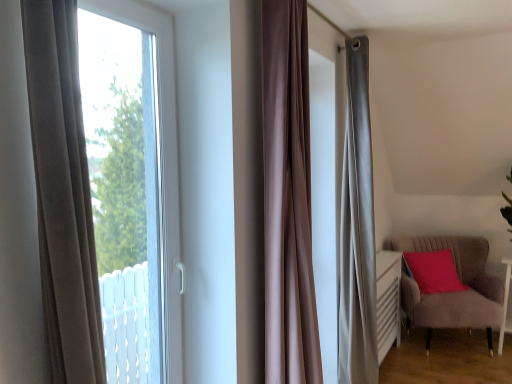
In order to click on velvet grey armchair at lower right in this screenshot , I will do `click(453, 292)`.

The image size is (512, 384). What do you see at coordinates (505, 304) in the screenshot?
I see `white glossy side table at lower right` at bounding box center [505, 304].

What do you see at coordinates (433, 271) in the screenshot? I see `matte pink cushion at right` at bounding box center [433, 271].

This screenshot has width=512, height=384. What are the coordinates of `satin brown curtain at center` in the screenshot? It's located at (288, 198).

You are a GUI agent. You are given a task and a screenshot of the screen. Output one action in this format:
    pyautogui.click(x=<x>, y=<y>)
    Task: Click on the velvet grey armchair at lower right
    
    Given the screenshot: What is the action you would take?
    pyautogui.click(x=453, y=292)

Is white glossy side table at lower right wider or thinner than satin brown curtain at center?

white glossy side table at lower right is wider than satin brown curtain at center.

From the image's perspective, is white glossy side table at lower right under satin brown curtain at center?

Indeed, from the image's perspective, white glossy side table at lower right is shown beneath satin brown curtain at center.

Between white glossy side table at lower right and satin brown curtain at center, which one is positioned in front?

satin brown curtain at center is in front.

From a real-world perspective, is white glossy side table at lower right under satin brown curtain at center?

Yes, from a real-world perspective, white glossy side table at lower right is under satin brown curtain at center.

Which is behind, point (473, 276) or point (502, 323)?

The point (473, 276) is more distant.

Considering the relative positions of velvet grey armchair at lower right and white glossy side table at lower right in the image provided, is velvet grey armchair at lower right to the right of white glossy side table at lower right from the viewer's perspective?

No.

Are velvet grey armchair at lower right and white glossy side table at lower right located far from each other?

No, velvet grey armchair at lower right is not far away from white glossy side table at lower right.

Between point (508, 290) and point (445, 289), which one is positioned behind?

The point (445, 289) is behind.

How many degrees apart are the facing directions of white glossy side table at lower right and matte pink cushion at right?

The facing directions of white glossy side table at lower right and matte pink cushion at right are 40.4 degrees apart.

Is white glossy side table at lower right further to the viewer compared to matte pink cushion at right?

No, white glossy side table at lower right is closer to the viewer.

Consider the image. From the image's perspective, between white glossy side table at lower right and matte pink cushion at right, which one is located above?

From the image's view, matte pink cushion at right is above.

From the image's perspective, which one is positioned higher, velvet grey armchair at lower right or satin brown curtain at center?

satin brown curtain at center is shown above in the image.

Considering the positions of objects velvet grey armchair at lower right and satin brown curtain at center in the image provided, who is behind, velvet grey armchair at lower right or satin brown curtain at center?

velvet grey armchair at lower right is further away from the camera.

Is point (440, 236) closer to viewer compared to point (272, 35)?

No, (440, 236) is further to viewer.

Is velvet grey armchair at lower right beside satin brown curtain at center?

velvet grey armchair at lower right is not next to satin brown curtain at center, and they're not touching.

How different are the orientations of matte pink cushion at right and white glossy side table at lower right in degrees?

matte pink cushion at right and white glossy side table at lower right are facing 40.4 degrees away from each other.

Could you tell me if matte pink cushion at right is turned towards white glossy side table at lower right?

No, matte pink cushion at right is not oriented towards white glossy side table at lower right.

From a real-world perspective, who is located lower, matte pink cushion at right or white glossy side table at lower right?

white glossy side table at lower right, from a real-world perspective.

Does matte pink cushion at right have a lesser width compared to white glossy side table at lower right?

Yes.

From a real-world perspective, is matte pink cushion at right beneath satin brown curtain at center?

Yes, from a real-world perspective, matte pink cushion at right is beneath satin brown curtain at center.

Is matte pink cushion at right thinner than satin brown curtain at center?

Incorrect, the width of matte pink cushion at right is not less than that of satin brown curtain at center.

Does matte pink cushion at right touch satin brown curtain at center?

No, matte pink cushion at right is not beside satin brown curtain at center.

Consider the image. Is matte pink cushion at right inside or outside of satin brown curtain at center?

matte pink cushion at right is not inside satin brown curtain at center, it's outside.

Is velvet grey armchair at lower right closer to camera compared to transparent glass window at left?

That is False.

Considering the relative sizes of velvet grey armchair at lower right and transparent glass window at left in the image provided, is velvet grey armchair at lower right thinner than transparent glass window at left?

Incorrect, the width of velvet grey armchair at lower right is not less than that of transparent glass window at left.

Measure the distance from velvet grey armchair at lower right to transparent glass window at left.

A distance of 9.20 feet exists between velvet grey armchair at lower right and transparent glass window at left.

Would you say transparent glass window at left is part of velvet grey armchair at lower right's contents?

Actually, transparent glass window at left is outside velvet grey armchair at lower right.

I want to click on side table that appears on the right of satin brown curtain at center, so click(x=505, y=304).

The image size is (512, 384). Identify the location of side table lying below the velvet grey armchair at lower right (from the image's perspective). (505, 304).

Based on their spatial positions, is matte pink cushion at right or satin brown curtain at center closer to transparent glass window at left?

satin brown curtain at center is positioned closer to the anchor transparent glass window at left.

Which object lies nearer to the anchor point transparent glass window at left, satin brown curtain at center or white glossy side table at lower right?

Among the two, satin brown curtain at center is located nearer to transparent glass window at left.

Which object lies further to the anchor point transparent glass window at left, velvet grey armchair at lower right or satin brown curtain at center?

Based on the image, velvet grey armchair at lower right appears to be further to transparent glass window at left.

When comparing their distances from satin brown curtain at center, does transparent glass window at left or matte pink cushion at right seem closer?

transparent glass window at left lies closer to satin brown curtain at center than the other object.

Estimate the real-world distances between objects in this image. Which object is further from matte pink cushion at right, satin brown curtain at center or velvet grey armchair at lower right?

Based on the image, satin brown curtain at center appears to be further to matte pink cushion at right.

Based on their spatial positions, is white glossy side table at lower right or satin brown curtain at center further from transparent glass window at left?

white glossy side table at lower right lies further to transparent glass window at left than the other object.

Considering their positions, is satin brown curtain at center positioned further to white glossy side table at lower right than transparent glass window at left?

transparent glass window at left.

Looking at the image, which one is located further to matte pink cushion at right, transparent glass window at left or velvet grey armchair at lower right?

Among the two, transparent glass window at left is located further to matte pink cushion at right.

The image size is (512, 384). Find the location of `curtain between transparent glass window at left and velvet grey armchair at lower right in the front-back direction`. curtain between transparent glass window at left and velvet grey armchair at lower right in the front-back direction is located at coordinates (x=288, y=198).

At what (x,y) coordinates should I click in order to perform the action: click on chair situated between matte pink cushion at right and white glossy side table at lower right from left to right. Please return your answer as a coordinate pair (x, y). Image resolution: width=512 pixels, height=384 pixels. Looking at the image, I should click on (453, 292).

At what (x,y) coordinates should I click in order to perform the action: click on chair positioned between satin brown curtain at center and matte pink cushion at right from near to far. Please return your answer as a coordinate pair (x, y). The height and width of the screenshot is (384, 512). Looking at the image, I should click on (453, 292).

Locate an element on the screen. This screenshot has width=512, height=384. chair located between transparent glass window at left and white glossy side table at lower right in the depth direction is located at coordinates tap(453, 292).